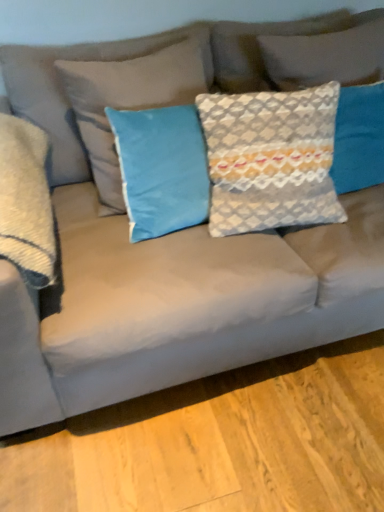
Question: Does blue velvet pillow at center, placed as the 2th pillow when sorted from left to right, have a lesser width compared to textured gray pillow at center, the third pillow when ordered from left to right?

Choices:
 (A) no
 (B) yes

Answer: (A)

Question: Considering the relative sizes of blue velvet pillow at center, placed as the 2th pillow when sorted from left to right, and textured gray pillow at center, positioned as the second pillow in right-to-left order, in the image provided, is blue velvet pillow at center, placed as the 2th pillow when sorted from left to right, wider than textured gray pillow at center, positioned as the second pillow in right-to-left order,?

Choices:
 (A) yes
 (B) no

Answer: (A)

Question: Is blue velvet pillow at center, marked as the 3th pillow in a right-to-left arrangement, at the left side of textured gray pillow at center, positioned as the second pillow in right-to-left order?

Choices:
 (A) no
 (B) yes

Answer: (B)

Question: Is textured gray pillow at center, positioned as the second pillow in right-to-left order, located within blue velvet pillow at center, placed as the 2th pillow when sorted from left to right?

Choices:
 (A) no
 (B) yes

Answer: (A)

Question: Is textured gray pillow at center, positioned as the second pillow in right-to-left order, at the back of blue velvet pillow at center, placed as the 2th pillow when sorted from left to right?

Choices:
 (A) no
 (B) yes

Answer: (A)

Question: Does point (211, 183) appear closer or farther from the camera than point (66, 156)?

Choices:
 (A) farther
 (B) closer

Answer: (B)

Question: Considering the relative positions of textured gray pillow at center, the third pillow when ordered from left to right, and blue velvet pillow at center, placed as the 2th pillow when sorted from left to right, in the image provided, is textured gray pillow at center, the third pillow when ordered from left to right, to the left or to the right of blue velvet pillow at center, placed as the 2th pillow when sorted from left to right,?

Choices:
 (A) right
 (B) left

Answer: (A)

Question: From the image's perspective, is textured gray pillow at center, the third pillow when ordered from left to right, positioned above or below blue velvet pillow at center, marked as the 3th pillow in a right-to-left arrangement?

Choices:
 (A) above
 (B) below

Answer: (B)

Question: Looking at their shapes, would you say textured gray pillow at center, the third pillow when ordered from left to right, is wider or thinner than blue velvet pillow at center, marked as the 3th pillow in a right-to-left arrangement?

Choices:
 (A) wide
 (B) thin

Answer: (B)

Question: From a real-world perspective, relative to satin gray pillow at left, acting as the 1th pillow starting from the left, is textured gray pillow at upper right, which is counted as the 4th pillow, starting from the left, vertically above or below?

Choices:
 (A) below
 (B) above

Answer: (B)

Question: Is textured gray pillow at upper right, the first pillow when ordered from right to left, in front of or behind satin gray pillow at left, acting as the 1th pillow starting from the left, in the image?

Choices:
 (A) front
 (B) behind

Answer: (B)

Question: In the image, is textured gray pillow at upper right, which is counted as the 4th pillow, starting from the left, on the left side or the right side of satin gray pillow at left, the fourth pillow positioned from the right?

Choices:
 (A) left
 (B) right

Answer: (B)

Question: Which is correct: textured gray pillow at upper right, the first pillow when ordered from right to left, is inside satin gray pillow at left, acting as the 1th pillow starting from the left, or outside of it?

Choices:
 (A) outside
 (B) inside

Answer: (A)

Question: Is textured gray pillow at upper right, the first pillow when ordered from right to left, situated inside textured gray pillow at center, positioned as the second pillow in right-to-left order, or outside?

Choices:
 (A) outside
 (B) inside

Answer: (A)

Question: Considering their positions, is textured gray pillow at upper right, which is counted as the 4th pillow, starting from the left, located in front of or behind textured gray pillow at center, the third pillow when ordered from left to right?

Choices:
 (A) behind
 (B) front

Answer: (A)